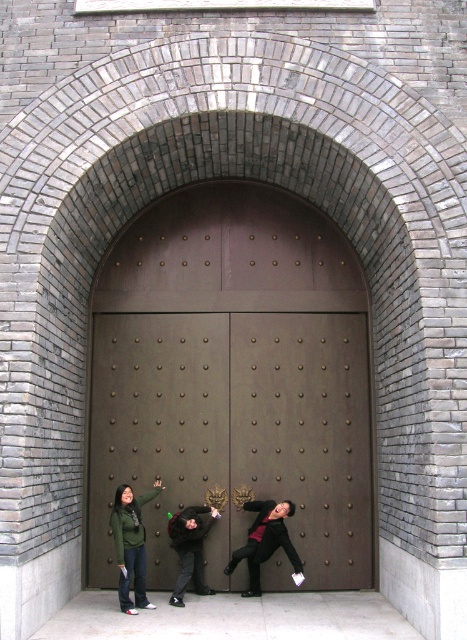
You are standing in front of the ornate wooden door and notice two items in the scene. Which one is closer to you, the brown polished wood door at center or the dark gray fabric jacket at lower center?

The brown polished wood door at center is closer to you than the dark gray fabric jacket at lower center, which is positioned behind it.

You are a photographer setting up a shoot in front of the ornate wooden door. You have two jackets to place on a stand in the scene. The black leather jacket at lower center and the dark gray fabric jacket at lower center. Which jacket should you choose if you want the one that takes up more horizontal space in the photo?

The black leather jacket at lower center should be chosen because its width surpasses that of the dark gray fabric jacket at lower center, making it take up more horizontal space in the photo.

Consider the image. You are a painter standing in front of the brown polished wood door at center and the dark gray fabric jacket at lower center. Which object do you need to paint first if you follow the rule of painting smaller objects first?

The brown polished wood door at center has a smaller size compared to the dark gray fabric jacket at lower center, so you should paint the brown polished wood door at center first.